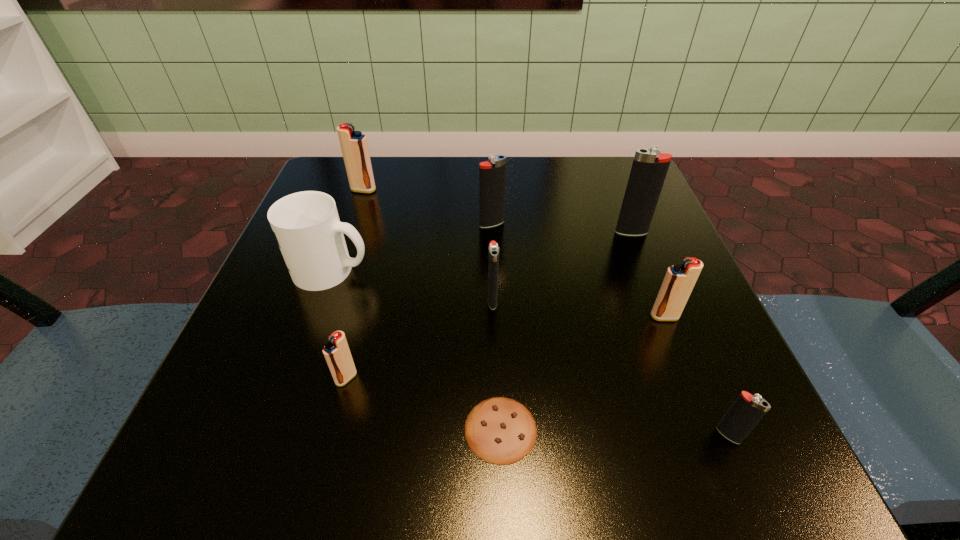
You are a GUI agent. You are given a task and a screenshot of the screen. Output one action in this format:
    pyautogui.click(x=<x>, y=<y>)
    Task: Click on the third nearest igniter
    
    Given the screenshot: What is the action you would take?
    pyautogui.click(x=679, y=281)

Image resolution: width=960 pixels, height=540 pixels. What are the coordinates of `the fourth nearest object` in the screenshot? It's located at (679, 281).

Locate an element on the screen. The width and height of the screenshot is (960, 540). the second red igniter from left to right is located at coordinates (336, 352).

The width and height of the screenshot is (960, 540). In order to click on the smallest red igniter in this screenshot , I will do `click(336, 352)`.

Locate an element on the screen. Image resolution: width=960 pixels, height=540 pixels. the smallest black igniter is located at coordinates (747, 410).

This screenshot has width=960, height=540. I want to click on the nearest black igniter, so click(x=747, y=410).

What are the coordinates of `cookie` in the screenshot? It's located at (499, 430).

This screenshot has width=960, height=540. Find the location of `vacant space located 0.090m on the back of the tallest object`. vacant space located 0.090m on the back of the tallest object is located at coordinates (619, 202).

I want to click on vacant region located 0.060m on the back of the farthest red igniter, so click(370, 172).

Find the location of a particular element. This screenshot has width=960, height=540. vacant space located 0.260m on the right of the eighth nearest object is located at coordinates (636, 224).